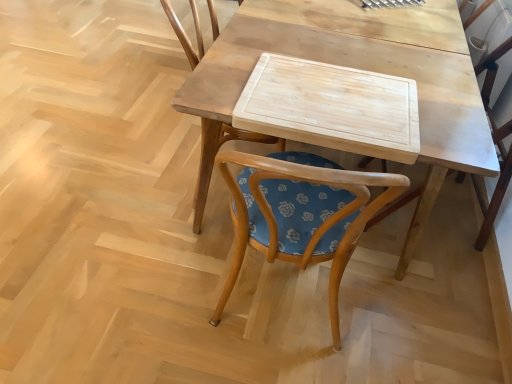
Question: From a real-world perspective, is wooden cutting board at center positioned over wooden chair at center, positioned as the 2th chair in left-to-right order, based on gravity?

Choices:
 (A) yes
 (B) no

Answer: (B)

Question: Is wooden cutting board at center turned away from wooden chair at center, positioned as the 2th chair in left-to-right order?

Choices:
 (A) no
 (B) yes

Answer: (B)

Question: Is wooden cutting board at center smaller than wooden chair at center, arranged as the 1th chair when viewed from the right?

Choices:
 (A) yes
 (B) no

Answer: (B)

Question: Considering the relative sizes of wooden cutting board at center and wooden chair at center, positioned as the 2th chair in left-to-right order, in the image provided, is wooden cutting board at center thinner than wooden chair at center, positioned as the 2th chair in left-to-right order,?

Choices:
 (A) yes
 (B) no

Answer: (B)

Question: Could you tell me if wooden cutting board at center is facing wooden chair at center, positioned as the 2th chair in left-to-right order?

Choices:
 (A) no
 (B) yes

Answer: (B)

Question: From the image's perspective, is wooden cutting board at center above wooden chair at center, arranged as the 1th chair when viewed from the right?

Choices:
 (A) no
 (B) yes

Answer: (B)

Question: Considering the relative sizes of natural wood cutting board at center and wooden chair at center, positioned as the 2th chair in left-to-right order, in the image provided, is natural wood cutting board at center wider than wooden chair at center, positioned as the 2th chair in left-to-right order,?

Choices:
 (A) yes
 (B) no

Answer: (B)

Question: Is wooden chair at center, positioned as the 2th chair in left-to-right order, completely or partially inside natural wood cutting board at center?

Choices:
 (A) no
 (B) yes

Answer: (A)

Question: Is natural wood cutting board at center completely or partially outside of wooden chair at center, positioned as the 2th chair in left-to-right order?

Choices:
 (A) no
 (B) yes

Answer: (B)

Question: Can you confirm if natural wood cutting board at center is thinner than wooden chair at center, arranged as the 1th chair when viewed from the right?

Choices:
 (A) yes
 (B) no

Answer: (A)

Question: Is natural wood cutting board at center facing away from wooden chair at center, positioned as the 2th chair in left-to-right order?

Choices:
 (A) no
 (B) yes

Answer: (A)

Question: Does natural wood cutting board at center have a larger size compared to wooden chair at center, positioned as the 2th chair in left-to-right order?

Choices:
 (A) no
 (B) yes

Answer: (A)

Question: Is natural wood cutting board at center further to camera compared to wooden cutting board at center?

Choices:
 (A) yes
 (B) no

Answer: (A)